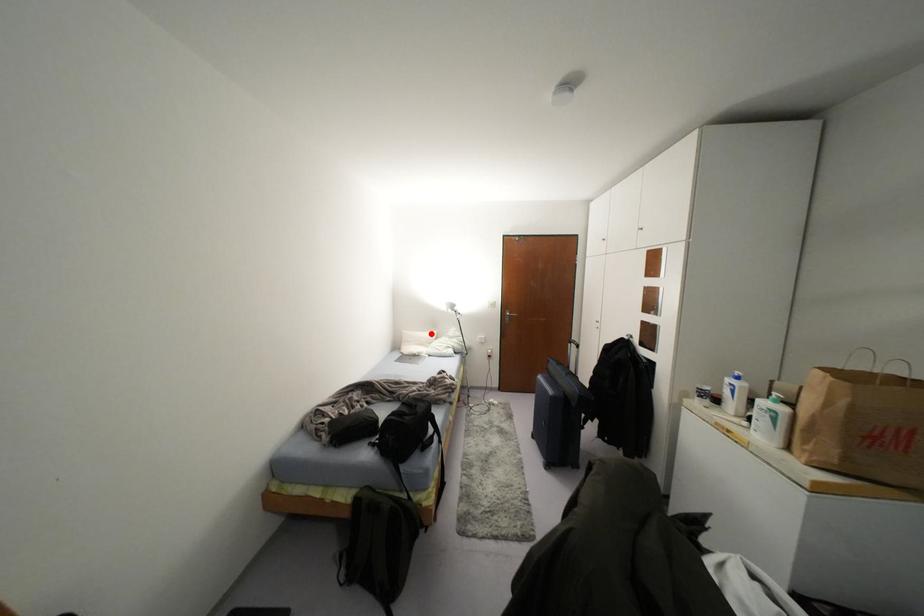
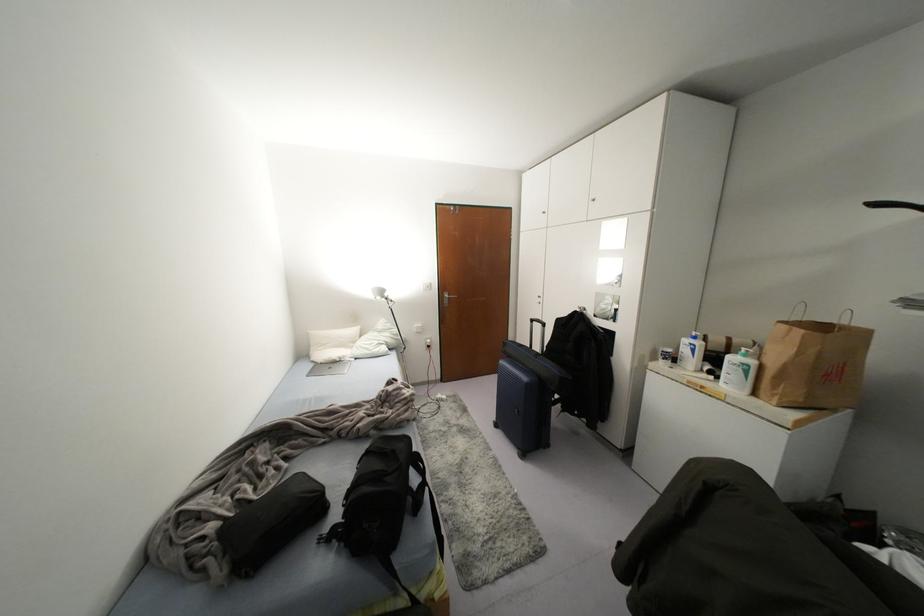
The point at the highlighted location is marked in the first image. Where is the corresponding point in the second image?

(354, 330)